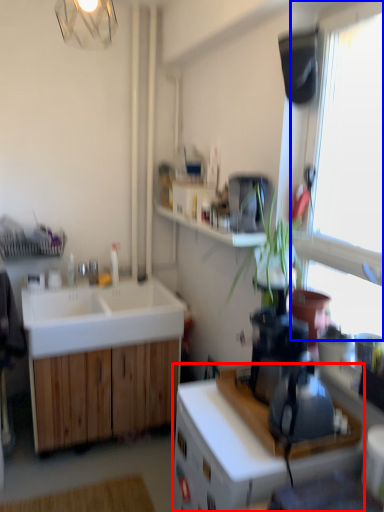
Question: Which point is closer to the camera, cabinetry (highlighted by a red box) or window (highlighted by a blue box)?

Choices:
 (A) cabinetry
 (B) window

Answer: (B)